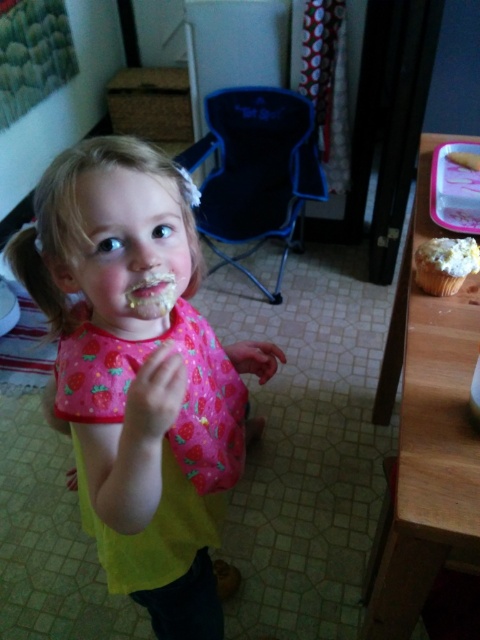
Which is above, matte pink bib at center or white frosted cupcake at upper right?

white frosted cupcake at upper right

Is matte pink bib at center wider than white frosted cupcake at upper right?

Indeed, matte pink bib at center has a greater width compared to white frosted cupcake at upper right.

Identify the location of matte pink bib at center. This screenshot has width=480, height=640. (130, 248).

Is pink fabric bib at center further to camera compared to matte pink bib at center?

No, it is in front of matte pink bib at center.

Who is taller, pink fabric bib at center or matte pink bib at center?

With more height is pink fabric bib at center.

Does point (216, 627) lie in front of point (84, 285)?

No, (216, 627) is behind (84, 285).

The width and height of the screenshot is (480, 640). I want to click on pink fabric bib at center, so click(x=140, y=365).

From the picture: Is pink fabric bib at center wider than white frosted cupcake at upper right?

Yes, pink fabric bib at center is wider than white frosted cupcake at upper right.

Between point (70, 400) and point (433, 284), which one is positioned in front?

Point (70, 400) is in front.

At what (x,y) coordinates should I click in order to perform the action: click on pink fabric bib at center. Please return your answer as a coordinate pair (x, y). This screenshot has height=640, width=480. Looking at the image, I should click on (140, 365).